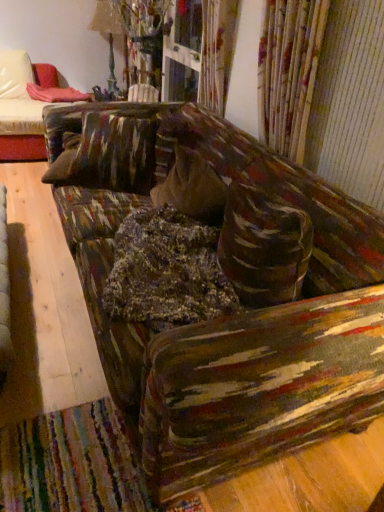
Question: Is pink fabric at upper left inside or outside of textured multicolored couch at center?

Choices:
 (A) inside
 (B) outside

Answer: (B)

Question: In the image, is pink fabric at upper left on the left side or the right side of textured multicolored couch at center?

Choices:
 (A) left
 (B) right

Answer: (A)

Question: Considering their positions, is pink fabric at upper left located in front of or behind textured multicolored couch at center?

Choices:
 (A) front
 (B) behind

Answer: (B)

Question: In the image, is textured multicolored couch at center positioned in front of or behind pink fabric at upper left?

Choices:
 (A) behind
 (B) front

Answer: (B)

Question: Is textured multicolored couch at center inside or outside of pink fabric at upper left?

Choices:
 (A) inside
 (B) outside

Answer: (B)

Question: In terms of width, does textured multicolored couch at center look wider or thinner when compared to pink fabric at upper left?

Choices:
 (A) wide
 (B) thin

Answer: (A)

Question: From the image's perspective, is textured multicolored couch at center above or below pink fabric at upper left?

Choices:
 (A) above
 (B) below

Answer: (B)